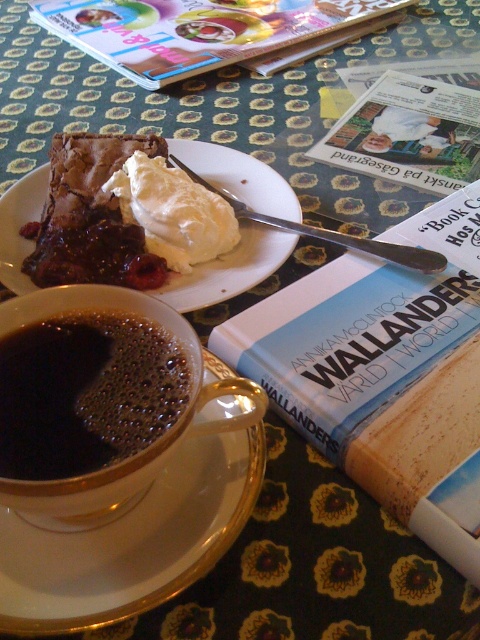
Is point (183, 16) positioned in front of point (360, 109)?

No, (183, 16) is behind (360, 109).

Can you confirm if matte plastic magazine at upper center is shorter than matte paper magazine at upper center?

In fact, matte plastic magazine at upper center may be taller than matte paper magazine at upper center.

Is point (359, 22) farther from viewer compared to point (477, 134)?

Yes, point (359, 22) is farther from viewer.

Locate an element on the screen. The image size is (480, 640). matte plastic magazine at upper center is located at coordinates (208, 32).

Does matte plastic magazine at upper center appear under white porcelain saucer at center?

Actually, matte plastic magazine at upper center is above white porcelain saucer at center.

Does matte plastic magazine at upper center have a lesser width compared to white porcelain saucer at center?

No.

Is point (76, 36) positioned in front of point (271, 170)?

No.

This screenshot has width=480, height=640. Find the location of `matte plastic magazine at upper center`. matte plastic magazine at upper center is located at coordinates (208, 32).

Which is behind, point (428, 99) or point (273, 173)?

Positioned behind is point (428, 99).

Is point (372, 132) positioned in front of point (241, 272)?

No, (372, 132) is further to viewer.

Find the location of a particular element. This screenshot has width=480, height=640. matte paper magazine at upper center is located at coordinates (408, 132).